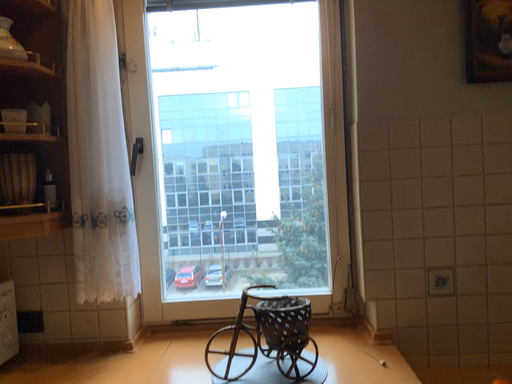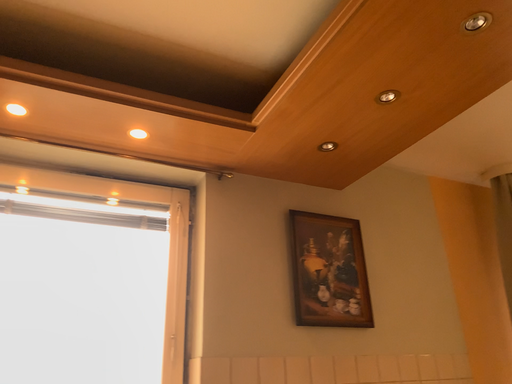
Question: How did the camera likely rotate when shooting the video?

Choices:
 (A) rotated downward
 (B) rotated upward

Answer: (B)